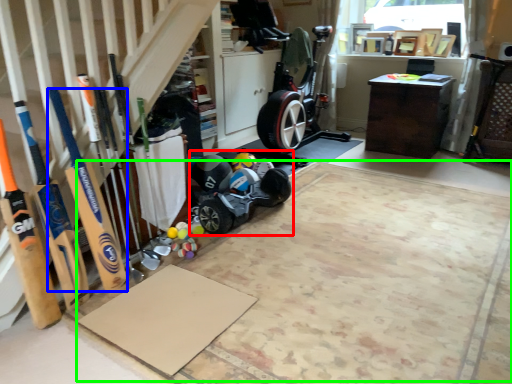
Question: Considering the real-world distances, which object is farthest from baby carriage (highlighted by a red box)? baseball bat (highlighted by a blue box) or yoga mat (highlighted by a green box)?

Choices:
 (A) baseball bat
 (B) yoga mat

Answer: (A)